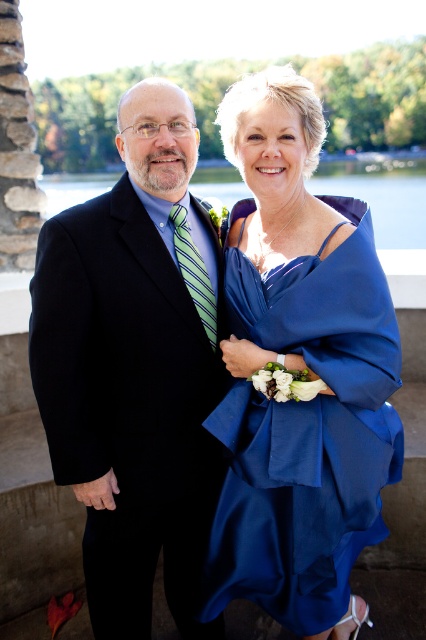
You are a photographer at a wedding. You need to position the couple so that the matte black suit at left is to the left of the blue satin dress at upper center. Is the current arrangement correct?

Yes, the current arrangement is correct because the matte black suit at left is already positioned to the left of the blue satin dress at upper center.

You are a photographer setting up for a formal event. You have two dresses in the scene, the satin blue dress at center and the blue satin dress at upper center. Which dress is narrower in width?

The satin blue dress at center has a lesser width compared to the blue satin dress at upper center, so the satin blue dress at center is narrower.